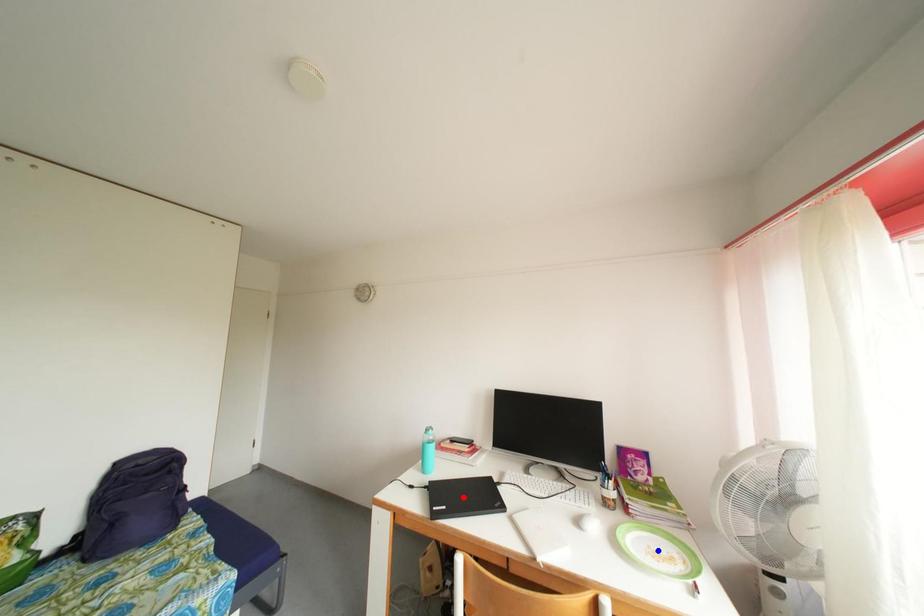
Question: In the image, two points are highlighted. Which point is nearer to the camera? Reply with the corresponding letter.

Choices:
 (A) blue point
 (B) red point

Answer: (A)